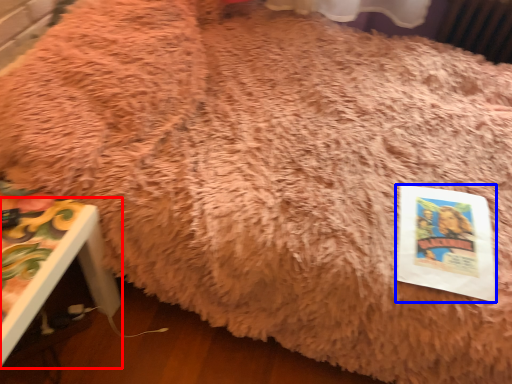
Question: Among these objects, which one is farthest to the camera, furniture (highlighted by a red box) or paperback book (highlighted by a blue box)?

Choices:
 (A) furniture
 (B) paperback book

Answer: (B)